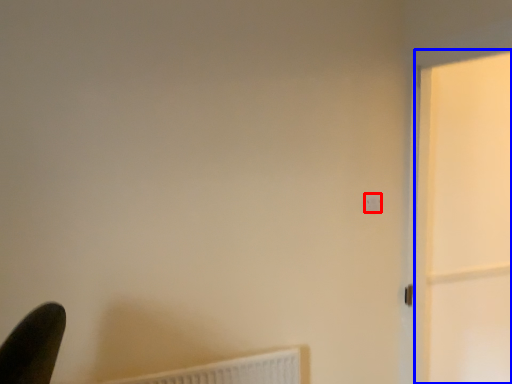
Question: Which object is further to the camera taking this photo, light switch (highlighted by a red box) or screen door (highlighted by a blue box)?

Choices:
 (A) light switch
 (B) screen door

Answer: (A)